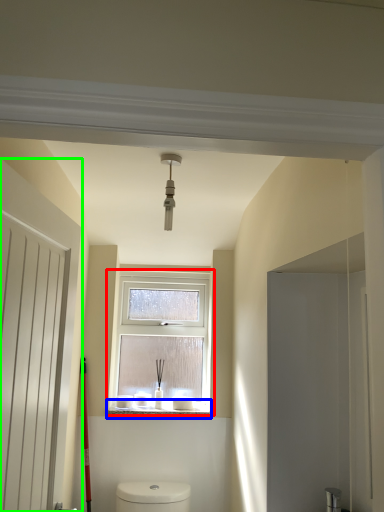
Question: Based on their relative distances, which object is nearer to window (highlighted by a red box)? Choose from window sill (highlighted by a blue box) and door (highlighted by a green box).

Choices:
 (A) window sill
 (B) door

Answer: (A)